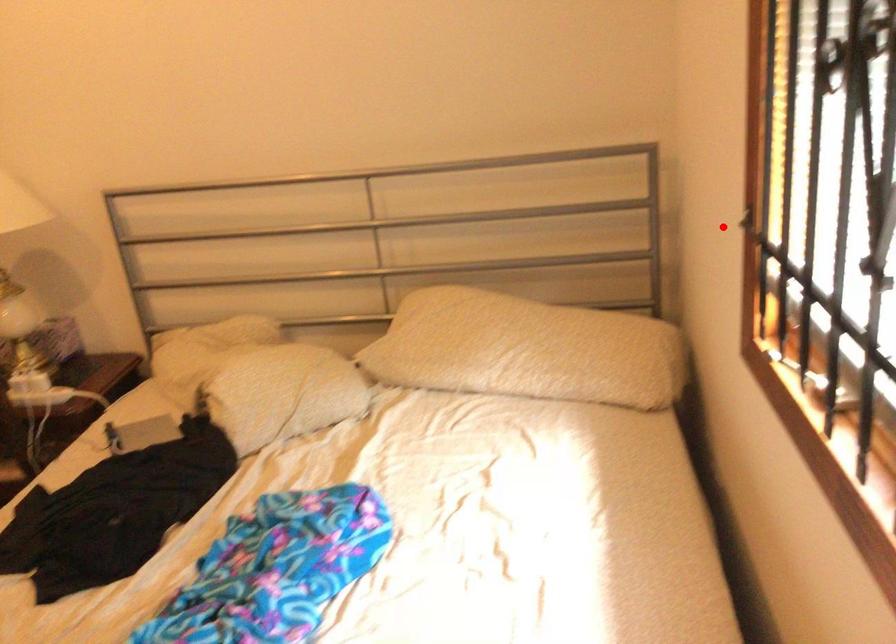
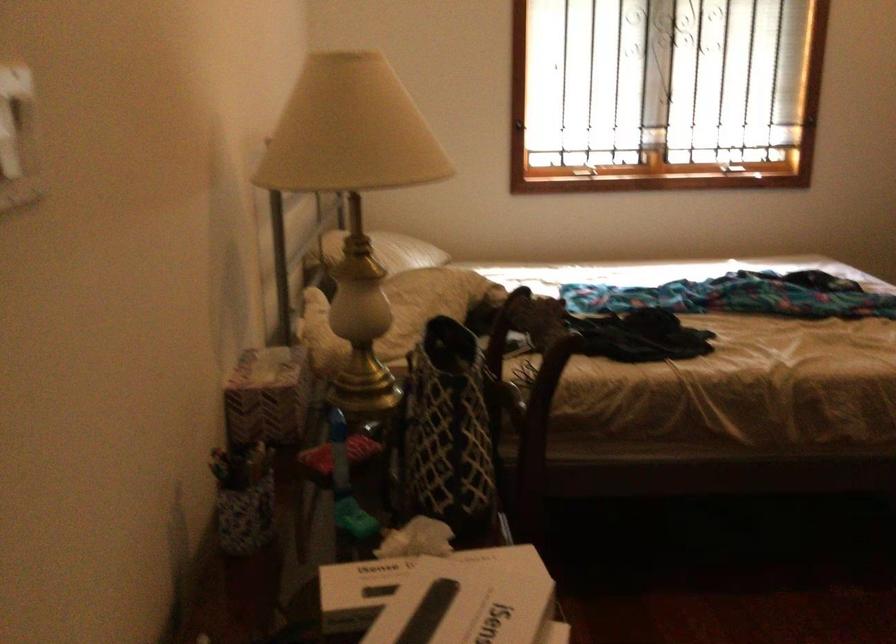
Find the pixel in the second image that matches the highlighted location in the first image.

(520, 124)